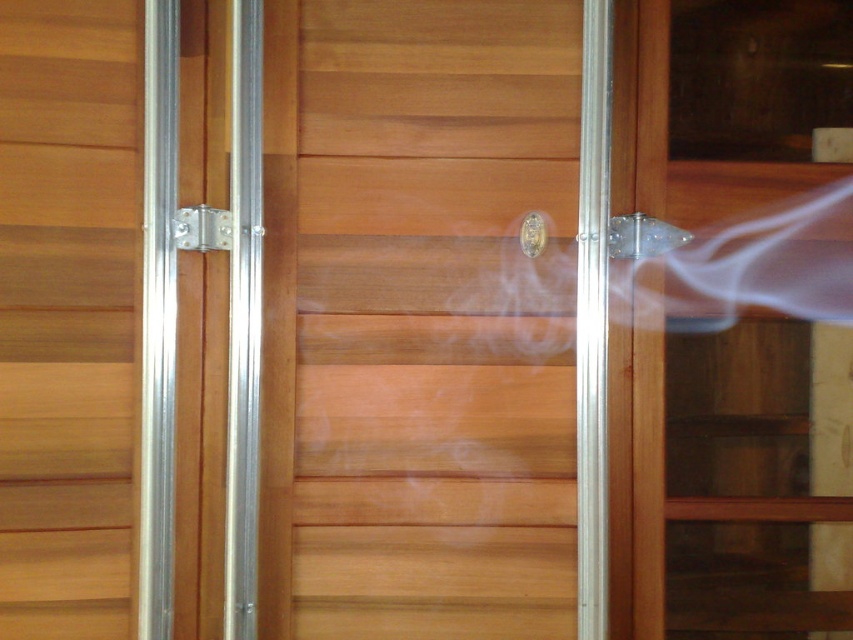
Question: Among these points, which one is farthest from the camera?

Choices:
 (A) (462, 188)
 (B) (637, 218)

Answer: (B)

Question: In this image, where is natural wood door at center located relative to clear plastic lock at center?

Choices:
 (A) right
 (B) left

Answer: (B)

Question: In this image, where is transparent glass door at center located relative to white translucent smoke at center?

Choices:
 (A) below
 (B) above

Answer: (A)

Question: Which of the following is the closest to the observer?

Choices:
 (A) (755, 481)
 (B) (216, 228)
 (C) (648, 252)
 (D) (646, 232)

Answer: (B)

Question: Based on their relative distances, which object is nearer to the silver metallic lock at center?

Choices:
 (A) white translucent smoke at center
 (B) natural wood door at center
 (C) transparent glass door at center
 (D) polished brass door handle at center

Answer: (B)

Question: Where is natural wood door at center located in relation to transparent glass door at center in the image?

Choices:
 (A) left
 (B) right

Answer: (A)